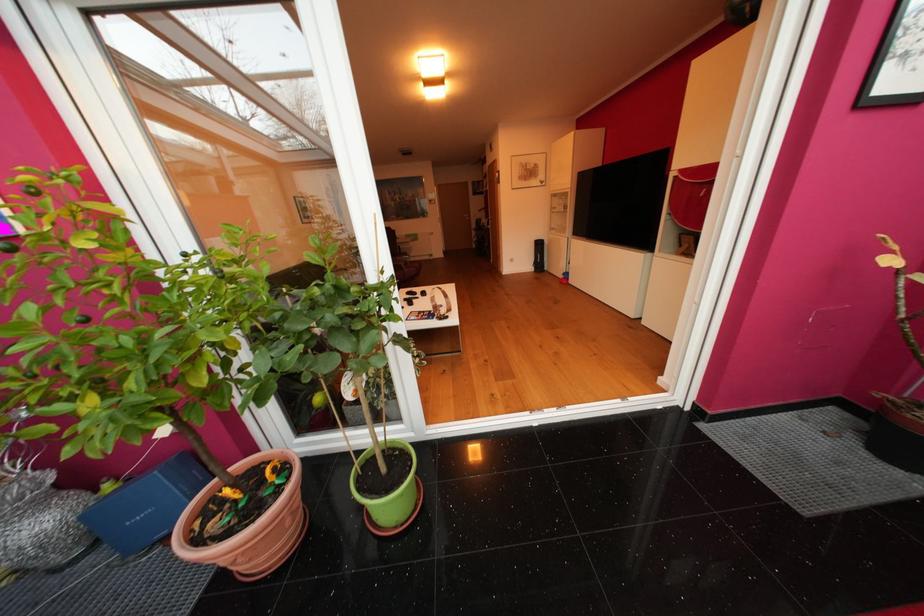
Find the location of a particular element. white sliding door frame is located at coordinates [355, 172].